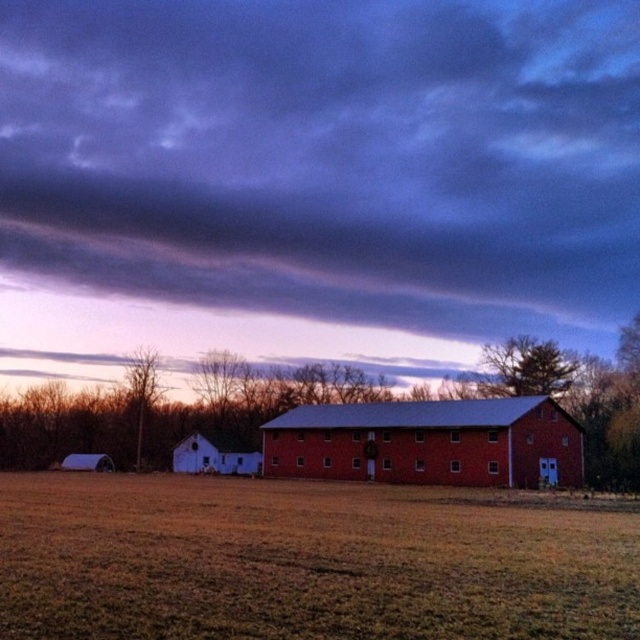
Question: Does brown grass at center appear on the right side of red brick barn at center?

Choices:
 (A) yes
 (B) no

Answer: (B)

Question: Does dark purple cloud at upper center appear over white matte barn at center?

Choices:
 (A) yes
 (B) no

Answer: (A)

Question: Among these points, which one is nearest to the camera?

Choices:
 (A) (294, 548)
 (B) (525, 305)
 (C) (196, 465)

Answer: (A)

Question: Which point is farther to the camera?

Choices:
 (A) red brick barn at center
 (B) dark purple cloud at upper center

Answer: (B)

Question: Considering the real-world distances, which object is farthest from the white matte barn at center?

Choices:
 (A) red brick barn at center
 (B) dark purple cloud at upper center

Answer: (B)

Question: Does dark purple cloud at upper center appear on the right side of white matte barn at center?

Choices:
 (A) yes
 (B) no

Answer: (A)